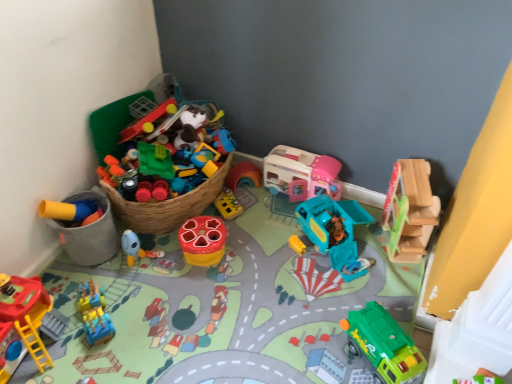
Locate an element on the screen. free spot behind blue rubber duck at center, which is the 3th toy in left-to-right order is located at coordinates (x=153, y=237).